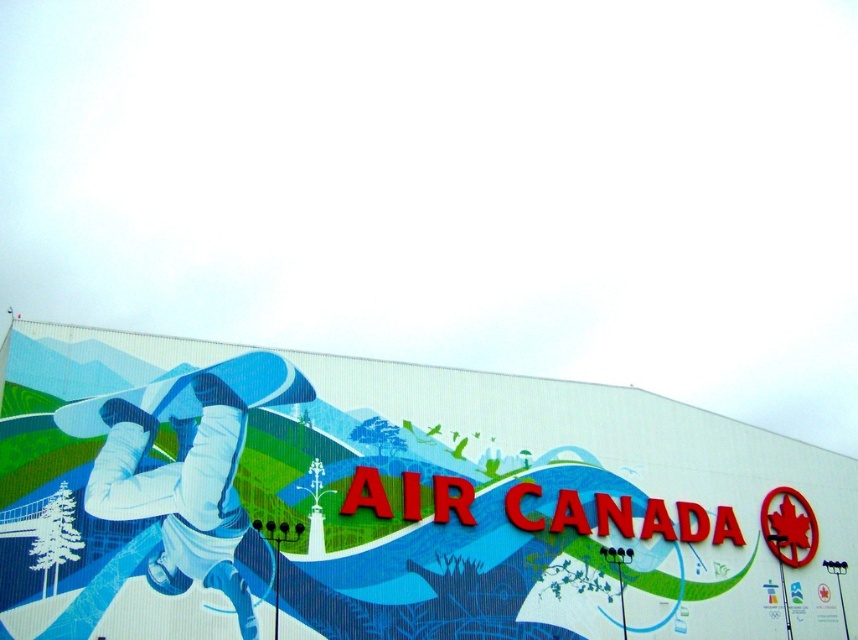
Between matte blue snowboarder at center and blue glossy skateboard at center-left, which one appears on the left side from the viewer's perspective?

blue glossy skateboard at center-left

Is point (228, 390) farther from viewer compared to point (216, 456)?

Yes.

The height and width of the screenshot is (640, 858). I want to click on matte blue snowboarder at center, so click(394, 502).